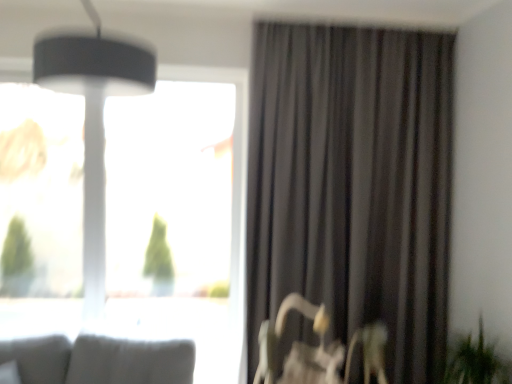
Question: Is point (476, 345) closer or farther from the camera than point (254, 190)?

Choices:
 (A) closer
 (B) farther

Answer: (A)

Question: Looking at their shapes, would you say green leafy plant at lower right is wider or thinner than dark grey fabric curtain at right?

Choices:
 (A) thin
 (B) wide

Answer: (B)

Question: Estimate the real-world distances between objects in this image. Which object is farther from the green leafy plant at lower right?

Choices:
 (A) dark grey fabric curtain at right
 (B) transparent glass window at upper left
 (C) metallic silver swivel chair at lower right
 (D) matte black lampshade at upper left

Answer: (B)

Question: Which is nearer to the green leafy plant at lower right?

Choices:
 (A) matte black lampshade at upper left
 (B) dark grey fabric curtain at right
 (C) metallic silver swivel chair at lower right
 (D) transparent glass window at upper left

Answer: (C)